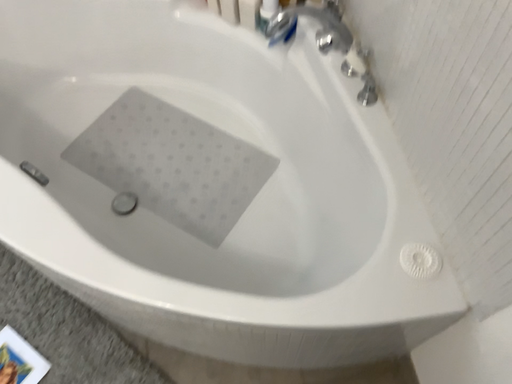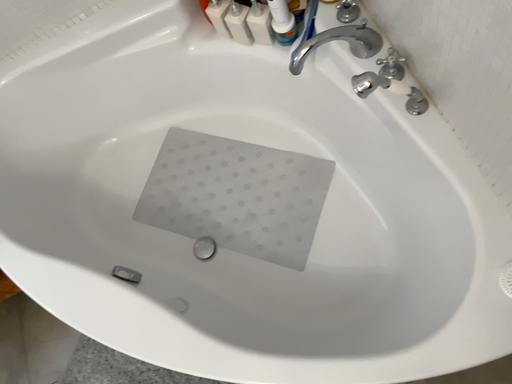
Question: How did the camera likely rotate when shooting the video?

Choices:
 (A) rotated upward
 (B) rotated downward

Answer: (B)